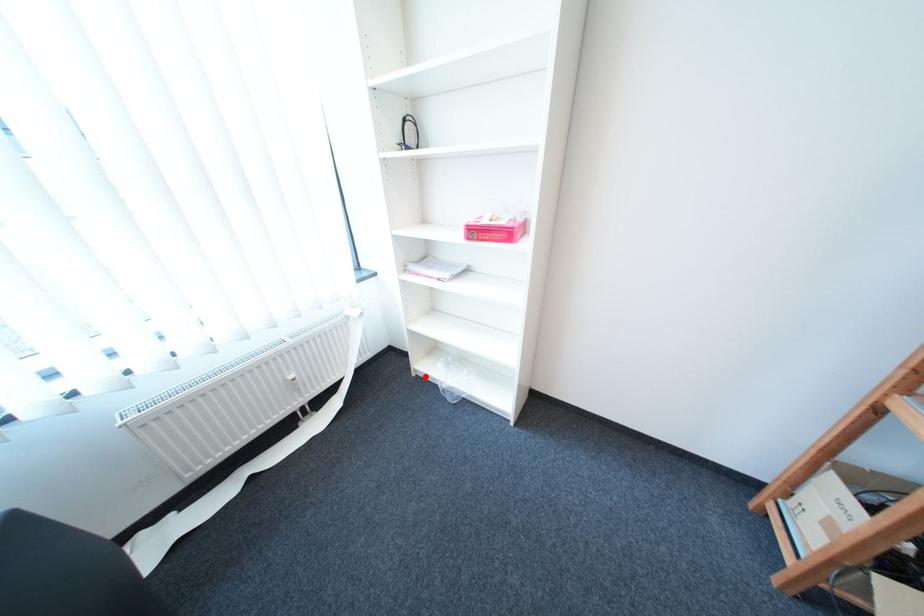
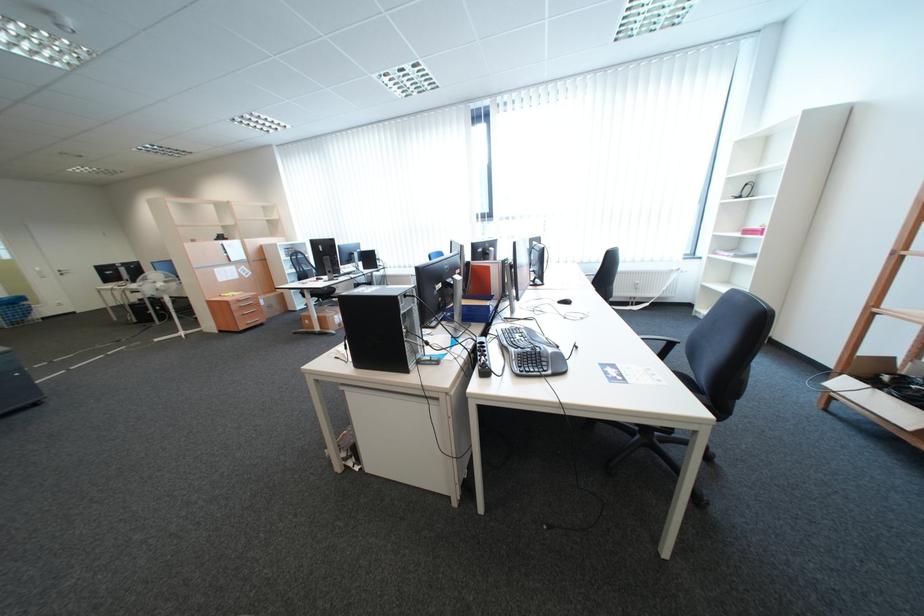
Question: I am providing you with two images of the same scene from different viewpoints. Given a red point in image1, look at the same physical point in image2. Is it:

Choices:
 (A) Closer to the viewpoint
 (B) Farther from the viewpoint

Answer: (A)